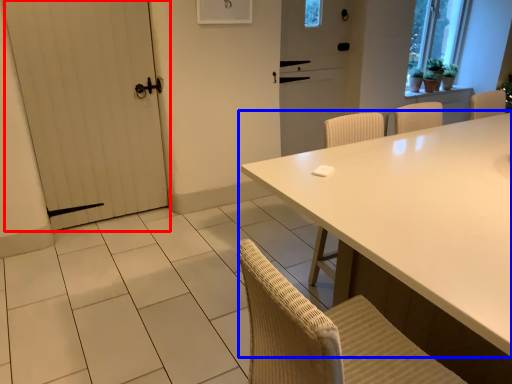
Question: Which object is closer to the camera taking this photo, door (highlighted by a red box) or table (highlighted by a blue box)?

Choices:
 (A) door
 (B) table

Answer: (B)